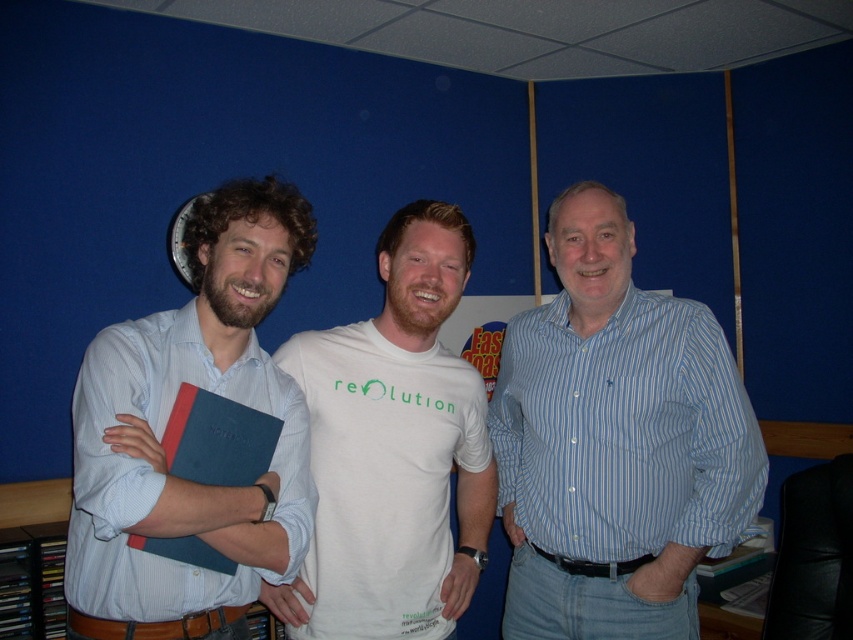
Can you confirm if blue striped shirt at center is taller than matte blue book at center?

Indeed, blue striped shirt at center has a greater height compared to matte blue book at center.

Where is `blue striped shirt at center`? The width and height of the screenshot is (853, 640). blue striped shirt at center is located at coordinates pyautogui.click(x=614, y=442).

Image resolution: width=853 pixels, height=640 pixels. In order to click on blue striped shirt at center in this screenshot , I will do `click(614, 442)`.

Can you confirm if blue striped shirt at center is positioned below white cotton t-shirt at center?

Correct, blue striped shirt at center is located below white cotton t-shirt at center.

Between blue striped shirt at center and white cotton t-shirt at center, which one appears on the right side from the viewer's perspective?

blue striped shirt at center

What do you see at coordinates (614, 442) in the screenshot?
I see `blue striped shirt at center` at bounding box center [614, 442].

This screenshot has width=853, height=640. What are the coordinates of `blue striped shirt at center` in the screenshot? It's located at (x=614, y=442).

Consider the image. Does blue striped shirt at center have a larger size compared to blue matte folder at center?

Indeed, blue striped shirt at center has a larger size compared to blue matte folder at center.

Between blue striped shirt at center and blue matte folder at center, which one is positioned higher?

Positioned higher is blue striped shirt at center.

This screenshot has width=853, height=640. What are the coordinates of `blue striped shirt at center` in the screenshot? It's located at (614, 442).

Identify the location of blue striped shirt at center. The width and height of the screenshot is (853, 640). (614, 442).